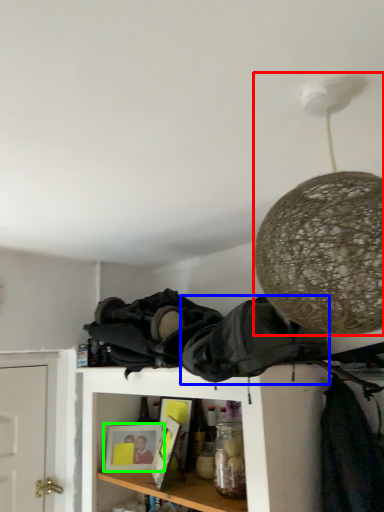
Question: Which object is the closest to the lamp (highlighted by a red box)? Choose among these: clothing (highlighted by a blue box) or picture frame (highlighted by a green box).

Choices:
 (A) clothing
 (B) picture frame

Answer: (A)